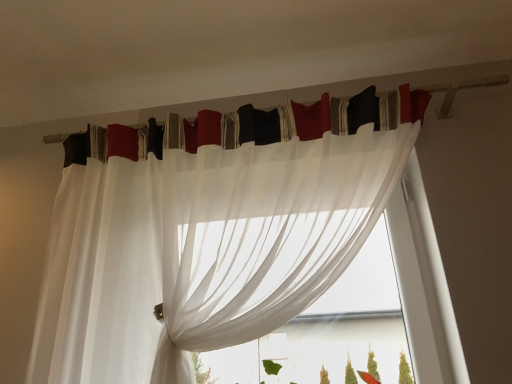
What do you see at coordinates (330, 332) in the screenshot? I see `sheer white curtain at center` at bounding box center [330, 332].

Locate an element on the screen. The width and height of the screenshot is (512, 384). white sheer curtain at upper center, the second curtain positioned from the bottom is located at coordinates (302, 119).

Can you confirm if sheer white curtain at upper center, arranged as the 2th curtain when viewed from the top, is positioned to the right of white sheer curtain at upper center, the second curtain positioned from the bottom?

No.

Which object is closer to the camera taking this photo, sheer white curtain at upper center, arranged as the 2th curtain when viewed from the top, or white sheer curtain at upper center, which is the first curtain in top-to-bottom order?

sheer white curtain at upper center, arranged as the 2th curtain when viewed from the top, is in front.

From the image's perspective, between sheer white curtain at upper center, which appears as the first curtain when ordered from the bottom, and white sheer curtain at upper center, which is the first curtain in top-to-bottom order, who is located below?

sheer white curtain at upper center, which appears as the first curtain when ordered from the bottom.

Between sheer white curtain at upper center, which appears as the first curtain when ordered from the bottom, and white sheer curtain at upper center, which is the first curtain in top-to-bottom order, which one has less height?

With less height is white sheer curtain at upper center, which is the first curtain in top-to-bottom order.

Could you tell me if white sheer curtain at upper center, the second curtain positioned from the bottom, is facing sheer white curtain at upper center, which appears as the first curtain when ordered from the bottom?

Yes, white sheer curtain at upper center, the second curtain positioned from the bottom, is aimed at sheer white curtain at upper center, which appears as the first curtain when ordered from the bottom.

This screenshot has height=384, width=512. Identify the location of curtain below the white sheer curtain at upper center, which is the first curtain in top-to-bottom order (from a real-world perspective). (214, 228).

Which object is wider, white sheer curtain at upper center, the second curtain positioned from the bottom, or sheer white curtain at upper center, which appears as the first curtain when ordered from the bottom?

sheer white curtain at upper center, which appears as the first curtain when ordered from the bottom, is wider.

Is white sheer curtain at upper center, the second curtain positioned from the bottom, further to the viewer compared to sheer white curtain at upper center, arranged as the 2th curtain when viewed from the top?

Yes, white sheer curtain at upper center, the second curtain positioned from the bottom, is behind sheer white curtain at upper center, arranged as the 2th curtain when viewed from the top.

Is sheer white curtain at center inside the boundaries of white sheer curtain at upper center, which is the first curtain in top-to-bottom order, or outside?

sheer white curtain at center is spatially situated outside white sheer curtain at upper center, which is the first curtain in top-to-bottom order.

Consider the image. From the image's perspective, is sheer white curtain at center beneath white sheer curtain at upper center, the second curtain positioned from the bottom?

Yes.

In the scene shown: Can you confirm if sheer white curtain at center is taller than white sheer curtain at upper center, which is the first curtain in top-to-bottom order?

Indeed, sheer white curtain at center has a greater height compared to white sheer curtain at upper center, which is the first curtain in top-to-bottom order.

Is sheer white curtain at center aimed at white sheer curtain at upper center, the second curtain positioned from the bottom?

Yes, sheer white curtain at center is facing white sheer curtain at upper center, the second curtain positioned from the bottom.

Consider the image. Is sheer white curtain at center surrounded by white sheer curtain at upper center, which is the first curtain in top-to-bottom order?

No, sheer white curtain at center is not inside white sheer curtain at upper center, which is the first curtain in top-to-bottom order.

From the image's perspective, starting from the sheer white curtain at center, which curtain is the 2nd one above? Please provide its 2D coordinates.

[(302, 119)]

From a real-world perspective, is white sheer curtain at upper center, the second curtain positioned from the bottom, over sheer white curtain at center?

Yes.

From the picture: From the image's perspective, is sheer white curtain at upper center, which appears as the first curtain when ordered from the bottom, above sheer white curtain at center?

Yes.

Considering the relative sizes of sheer white curtain at upper center, arranged as the 2th curtain when viewed from the top, and sheer white curtain at center in the image provided, is sheer white curtain at upper center, arranged as the 2th curtain when viewed from the top, thinner than sheer white curtain at center?

Indeed, sheer white curtain at upper center, arranged as the 2th curtain when viewed from the top, has a lesser width compared to sheer white curtain at center.

Is sheer white curtain at upper center, arranged as the 2th curtain when viewed from the top, shorter than sheer white curtain at center?

Incorrect, the height of sheer white curtain at upper center, arranged as the 2th curtain when viewed from the top, does not fall short of that of sheer white curtain at center.

Could you tell me if sheer white curtain at center is facing sheer white curtain at upper center, arranged as the 2th curtain when viewed from the top?

Yes, sheer white curtain at center is oriented towards sheer white curtain at upper center, arranged as the 2th curtain when viewed from the top.

Would you consider sheer white curtain at center to be distant from sheer white curtain at upper center, arranged as the 2th curtain when viewed from the top?

Actually, sheer white curtain at center and sheer white curtain at upper center, arranged as the 2th curtain when viewed from the top, are a little close together.

How many degrees apart are the facing directions of sheer white curtain at center and sheer white curtain at upper center, arranged as the 2th curtain when viewed from the top?

0.18 degrees separate the facing orientations of sheer white curtain at center and sheer white curtain at upper center, arranged as the 2th curtain when viewed from the top.

From a real-world perspective, who is located higher, sheer white curtain at center or sheer white curtain at upper center, which appears as the first curtain when ordered from the bottom?

sheer white curtain at upper center, which appears as the first curtain when ordered from the bottom.

Locate an element on the screen. curtain behind the sheer white curtain at upper center, which appears as the first curtain when ordered from the bottom is located at coordinates (302, 119).

The width and height of the screenshot is (512, 384). Find the location of `curtain below the white sheer curtain at upper center, which is the first curtain in top-to-bottom order (from the image's perspective)`. curtain below the white sheer curtain at upper center, which is the first curtain in top-to-bottom order (from the image's perspective) is located at coordinates (214, 228).

Looking at the image, which one is located further to white sheer curtain at upper center, which is the first curtain in top-to-bottom order, sheer white curtain at center or sheer white curtain at upper center, which appears as the first curtain when ordered from the bottom?

Among the two, sheer white curtain at center is located further to white sheer curtain at upper center, which is the first curtain in top-to-bottom order.

Based on their spatial positions, is sheer white curtain at upper center, which appears as the first curtain when ordered from the bottom, or white sheer curtain at upper center, the second curtain positioned from the bottom, further from sheer white curtain at center?

white sheer curtain at upper center, the second curtain positioned from the bottom, lies further to sheer white curtain at center than the other object.

From the image, which object appears to be farther from white sheer curtain at upper center, which is the first curtain in top-to-bottom order, sheer white curtain at upper center, which appears as the first curtain when ordered from the bottom, or sheer white curtain at center?

Among the two, sheer white curtain at center is located further to white sheer curtain at upper center, which is the first curtain in top-to-bottom order.

Estimate the real-world distances between objects in this image. Which object is closer to sheer white curtain at center, white sheer curtain at upper center, which is the first curtain in top-to-bottom order, or sheer white curtain at upper center, which appears as the first curtain when ordered from the bottom?

sheer white curtain at upper center, which appears as the first curtain when ordered from the bottom, is closer to sheer white curtain at center.

Based on their spatial positions, is white sheer curtain at upper center, the second curtain positioned from the bottom, or sheer white curtain at center closer to sheer white curtain at upper center, arranged as the 2th curtain when viewed from the top?

white sheer curtain at upper center, the second curtain positioned from the bottom, lies closer to sheer white curtain at upper center, arranged as the 2th curtain when viewed from the top, than the other object.

Which object lies further to the anchor point sheer white curtain at upper center, arranged as the 2th curtain when viewed from the top, sheer white curtain at center or white sheer curtain at upper center, the second curtain positioned from the bottom?

sheer white curtain at center is positioned further to the anchor sheer white curtain at upper center, arranged as the 2th curtain when viewed from the top.

Identify the location of curtain between white sheer curtain at upper center, which is the first curtain in top-to-bottom order, and sheer white curtain at center in the up-down direction. (214, 228).